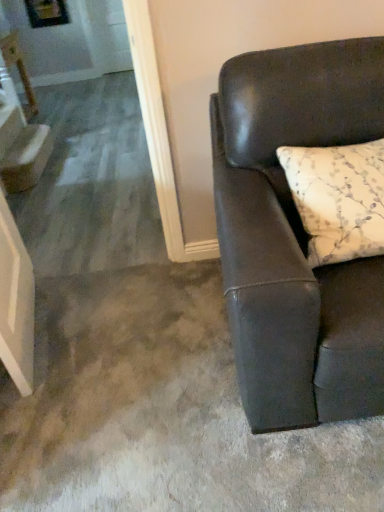
Question: Is white floral-patterned pillow at right oriented away from white glossy step at left?

Choices:
 (A) no
 (B) yes

Answer: (A)

Question: Is white floral-patterned pillow at right at the left side of white glossy step at left?

Choices:
 (A) yes
 (B) no

Answer: (B)

Question: From the image's perspective, is white floral-patterned pillow at right under white glossy step at left?

Choices:
 (A) yes
 (B) no

Answer: (A)

Question: Can you confirm if white floral-patterned pillow at right is taller than white glossy step at left?

Choices:
 (A) yes
 (B) no

Answer: (A)

Question: From a real-world perspective, is white floral-patterned pillow at right located beneath white glossy step at left?

Choices:
 (A) yes
 (B) no

Answer: (B)

Question: Is white floral-patterned pillow at right wider or thinner than matte black couch at right?

Choices:
 (A) thin
 (B) wide

Answer: (A)

Question: Is point (352, 200) positioned closer to the camera than point (294, 246)?

Choices:
 (A) closer
 (B) farther

Answer: (B)

Question: Is white floral-patterned pillow at right inside or outside of matte black couch at right?

Choices:
 (A) outside
 (B) inside

Answer: (B)

Question: From a real-world perspective, relative to matte black couch at right, is white floral-patterned pillow at right vertically above or below?

Choices:
 (A) below
 (B) above

Answer: (B)

Question: Considering their positions, is matte black couch at right located in front of or behind white glossy step at left?

Choices:
 (A) behind
 (B) front

Answer: (B)

Question: In the image, is matte black couch at right on the left side or the right side of white glossy step at left?

Choices:
 (A) right
 (B) left

Answer: (A)

Question: Based on their sizes in the image, would you say matte black couch at right is bigger or smaller than white glossy step at left?

Choices:
 (A) small
 (B) big

Answer: (B)

Question: Is matte black couch at right situated inside white glossy step at left or outside?

Choices:
 (A) outside
 (B) inside

Answer: (A)

Question: In the image, is matte black couch at right positioned in front of or behind white floral-patterned pillow at right?

Choices:
 (A) behind
 (B) front

Answer: (B)

Question: Is matte black couch at right bigger or smaller than white floral-patterned pillow at right?

Choices:
 (A) big
 (B) small

Answer: (A)